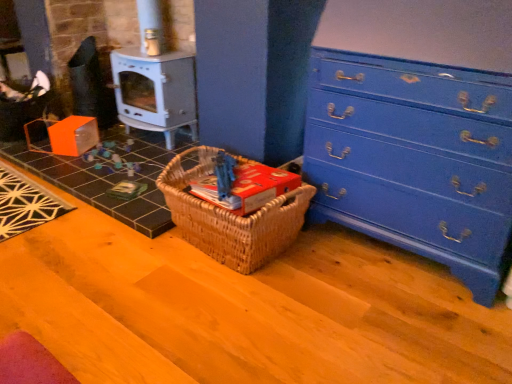
Locate an element on the screen. This screenshot has height=384, width=512. vacant space situated on the left part of woven wood picnic basket at center is located at coordinates (115, 253).